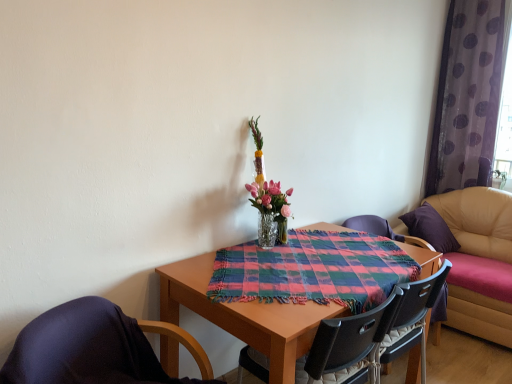
Find the location of a particular element. The width and height of the screenshot is (512, 384). black plastic chair at center, which is the 2th chair in back-to-front order is located at coordinates (369, 329).

What do you see at coordinates (479, 261) in the screenshot?
I see `leather couch at right` at bounding box center [479, 261].

Locate an element on the screen. leather couch at right is located at coordinates (479, 261).

Find the location of a particular element. The height and width of the screenshot is (384, 512). plaid fabric at center is located at coordinates (313, 270).

Locate an element on the screen. purple sheer curtain at right is located at coordinates (467, 94).

Is black plastic chair at center, which is the 2th chair in right-to-left order, taller or shorter than leather couch at right?

black plastic chair at center, which is the 2th chair in right-to-left order, is shorter than leather couch at right.

Consider the image. From the image's perspective, who appears lower, black plastic chair at center, which is the 2th chair in right-to-left order, or leather couch at right?

black plastic chair at center, which is the 2th chair in right-to-left order, appears lower in the image.

Considering the relative sizes of black plastic chair at center, the 2th chair in the left-to-right sequence, and leather couch at right in the image provided, is black plastic chair at center, the 2th chair in the left-to-right sequence, wider than leather couch at right?

Incorrect, the width of black plastic chair at center, the 2th chair in the left-to-right sequence, does not surpass that of leather couch at right.

Is black plastic chair at center, which is the 2th chair in back-to-front order, in front of or behind leather couch at right in the image?

Clearly, black plastic chair at center, which is the 2th chair in back-to-front order, is in front of leather couch at right.

From a real-world perspective, is black plastic chair at center, placed as the first chair when sorted from right to left, above or below purple sheer curtain at right?

black plastic chair at center, placed as the first chair when sorted from right to left, is situated lower than purple sheer curtain at right in the real world.

From the image's perspective, between black plastic chair at center, placed as the first chair when sorted from right to left, and purple sheer curtain at right, who is located below?

black plastic chair at center, placed as the first chair when sorted from right to left, from the image's perspective.

Find the location of a particular element. This screenshot has width=512, height=384. the 1st chair to the left when counting from the purple sheer curtain at right is located at coordinates (382, 229).

Does point (432, 330) appear closer or farther from the camera than point (450, 177)?

Point (432, 330) is closer to the camera than point (450, 177).

Between point (258, 209) and point (260, 256), which one is positioned in front?

Positioned in front is point (260, 256).

From the image's perspective, is clear glass vase at center located above plaid fabric at center?

Yes, from the image's perspective, clear glass vase at center is over plaid fabric at center.

Is clear glass vase at center facing away from plaid fabric at center?

clear glass vase at center does not have its back to plaid fabric at center.

Is clear glass vase at center smaller than plaid fabric at center?

Yes.

How much distance is there between black plastic chair at center, the 2th chair in the left-to-right sequence, and plaid fabric at center?

A distance of 11.01 inches exists between black plastic chair at center, the 2th chair in the left-to-right sequence, and plaid fabric at center.

Does point (296, 376) come behind point (309, 234)?

No, (296, 376) is in front of (309, 234).

Which object is further away from the camera taking this photo, black plastic chair at center, the 2th chair in the left-to-right sequence, or plaid fabric at center?

Positioned behind is plaid fabric at center.

Does black plastic chair at center, which is the 2th chair in right-to-left order, appear on the right side of plaid fabric at center?

In fact, black plastic chair at center, which is the 2th chair in right-to-left order, is to the left of plaid fabric at center.

The image size is (512, 384). Find the location of `curtain on the right of black plastic chair at center, which is the 2th chair in back-to-front order`. curtain on the right of black plastic chair at center, which is the 2th chair in back-to-front order is located at coordinates (467, 94).

Is black plastic chair at center, the 2th chair in the left-to-right sequence, to the left or to the right of purple sheer curtain at right in the image?

black plastic chair at center, the 2th chair in the left-to-right sequence, is positioned on purple sheer curtain at right's left side.

Consider the image. Can you confirm if black plastic chair at center, which is the 2th chair in back-to-front order, is smaller than purple sheer curtain at right?

Actually, black plastic chair at center, which is the 2th chair in back-to-front order, might be larger than purple sheer curtain at right.

Is black plastic chair at center, which is the second chair from front to back, inside or outside of purple sheer curtain at right?

black plastic chair at center, which is the second chair from front to back, is not inside purple sheer curtain at right, it's outside.

Which is closer to the camera, (378,223) or (462,278)?

Clearly, point (378,223) is more distant from the camera than point (462,278).

Can you confirm if black plastic chair at center, placed as the first chair when sorted from right to left, is wider than leather couch at right?

No.

Would you consider black plastic chair at center, which is the 1th chair in back-to-front order, to be distant from leather couch at right?

No, black plastic chair at center, which is the 1th chair in back-to-front order, is in close proximity to leather couch at right.

Looking at the image, does black plastic chair at center, placed as the first chair when sorted from right to left, seem bigger or smaller compared to leather couch at right?

black plastic chair at center, placed as the first chair when sorted from right to left, is smaller than leather couch at right.

Is leather couch at right surrounding clear glass vase at center?

No, clear glass vase at center is not a part of leather couch at right.

Is leather couch at right far away from clear glass vase at center?

Indeed, leather couch at right is not near clear glass vase at center.

Which of these two, leather couch at right or clear glass vase at center, stands shorter?

clear glass vase at center.

Does leather couch at right lie behind clear glass vase at center?

Yes, leather couch at right is further from the viewer.

At what (x,y) coordinates should I click in order to perform the action: click on studio couch lying behind the black plastic chair at center, which is the second chair from front to back. Please return your answer as a coordinate pair (x, y). The image size is (512, 384). Looking at the image, I should click on (479, 261).

Starting from the purple sheer curtain at right, which chair is the 1st one to the left? Please provide its 2D coordinates.

[(382, 229)]

Estimate the real-world distances between objects in this image. Which object is closer to purple fabric-covered chair at lower left, which is counted as the first chair, starting from the left, black plastic chair at center, placed as the first chair when sorted from right to left, or black plastic chair at center, which is the 2th chair in back-to-front order?

Based on the image, black plastic chair at center, which is the 2th chair in back-to-front order, appears to be nearer to purple fabric-covered chair at lower left, which is counted as the first chair, starting from the left.

In the scene shown: Considering their positions, is plaid fabric at center positioned further to clear glass vase at center than purple fabric-covered chair at lower left, the 1th chair when ordered from front to back?

Among the two, purple fabric-covered chair at lower left, the 1th chair when ordered from front to back, is located further to clear glass vase at center.

Considering their positions, is purple fabric-covered chair at lower left, which is the 3th chair in back-to-front order, positioned closer to purple sheer curtain at right than clear glass vase at center?

Among the two, clear glass vase at center is located nearer to purple sheer curtain at right.

Based on the photo, when comparing their distances from black plastic chair at center, the third chair viewed from the front, does plaid fabric at center or purple sheer curtain at right seem further?

Among the two, purple sheer curtain at right is located further to black plastic chair at center, the third chair viewed from the front.

Looking at the image, which one is located closer to plaid fabric at center, leather couch at right or purple sheer curtain at right?

leather couch at right is closer to plaid fabric at center.

In the scene shown: From the image, which object appears to be nearer to purple fabric-covered chair at lower left, which is counted as the first chair, starting from the left, black plastic chair at center, the 2th chair in the left-to-right sequence, or black plastic chair at center, placed as the first chair when sorted from right to left?

black plastic chair at center, the 2th chair in the left-to-right sequence, lies closer to purple fabric-covered chair at lower left, which is counted as the first chair, starting from the left, than the other object.

Looking at the image, which one is located closer to black plastic chair at center, the 2th chair in the left-to-right sequence, plaid fabric at center or clear glass vase at center?

plaid fabric at center is closer to black plastic chair at center, the 2th chair in the left-to-right sequence.

Looking at the image, which one is located further to clear glass vase at center, black plastic chair at center, placed as the first chair when sorted from right to left, or purple fabric-covered chair at lower left, the 1th chair when ordered from front to back?

purple fabric-covered chair at lower left, the 1th chair when ordered from front to back, is positioned further to the anchor clear glass vase at center.

Where is `studio couch between black plastic chair at center, which is the 2th chair in right-to-left order, and purple sheer curtain at right, along the z-axis`? studio couch between black plastic chair at center, which is the 2th chair in right-to-left order, and purple sheer curtain at right, along the z-axis is located at coordinates (479, 261).

Find the location of a particular element. This screenshot has width=512, height=384. studio couch located between clear glass vase at center and purple sheer curtain at right in the left-right direction is located at coordinates (479, 261).

Identify the location of cloth situated between clear glass vase at center and leather couch at right from left to right. (313, 270).

Locate an element on the screen. Image resolution: width=512 pixels, height=384 pixels. cloth between purple fabric-covered chair at lower left, which is counted as the first chair, starting from the left, and black plastic chair at center, placed as the first chair when sorted from right to left is located at coordinates (313, 270).